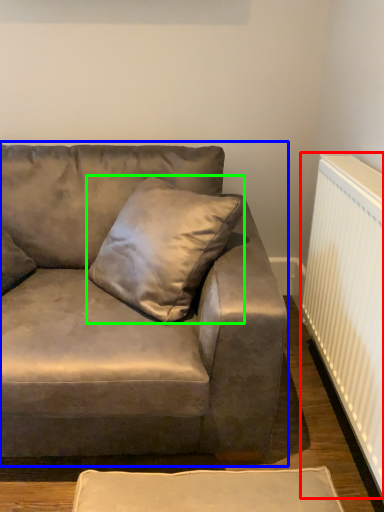
Question: Considering the real-world distances, which object is farthest from radiator (highlighted by a red box)? studio couch (highlighted by a blue box) or pillow (highlighted by a green box)?

Choices:
 (A) studio couch
 (B) pillow

Answer: (B)